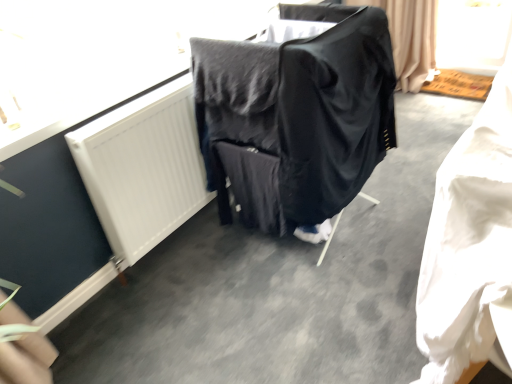
Question: Does white fabric at lower right have a greater width compared to white matte radiator at upper left?

Choices:
 (A) yes
 (B) no

Answer: (A)

Question: Can you confirm if white fabric at lower right is shorter than white matte radiator at upper left?

Choices:
 (A) yes
 (B) no

Answer: (B)

Question: Can you confirm if white fabric at lower right is positioned to the right of white matte radiator at upper left?

Choices:
 (A) no
 (B) yes

Answer: (B)

Question: Does white fabric at lower right have a lesser width compared to white matte radiator at upper left?

Choices:
 (A) no
 (B) yes

Answer: (A)

Question: From a real-world perspective, is white fabric at lower right beneath white matte radiator at upper left?

Choices:
 (A) yes
 (B) no

Answer: (B)

Question: Is black fabric-covered chair at center in front of or behind white matte radiator at upper left in the image?

Choices:
 (A) front
 (B) behind

Answer: (A)

Question: From the image's perspective, is black fabric-covered chair at center positioned above or below white matte radiator at upper left?

Choices:
 (A) above
 (B) below

Answer: (A)

Question: Visually, is black fabric-covered chair at center positioned to the left or to the right of white matte radiator at upper left?

Choices:
 (A) left
 (B) right

Answer: (B)

Question: Is black fabric-covered chair at center inside or outside of white matte radiator at upper left?

Choices:
 (A) inside
 (B) outside

Answer: (B)

Question: From the image's perspective, is white fabric at lower right located above or below white matte radiator at upper left?

Choices:
 (A) below
 (B) above

Answer: (A)

Question: In the image, is white fabric at lower right positioned in front of or behind white matte radiator at upper left?

Choices:
 (A) behind
 (B) front

Answer: (B)

Question: Is white fabric at lower right inside or outside of white matte radiator at upper left?

Choices:
 (A) inside
 (B) outside

Answer: (B)

Question: Considering the positions of point (487, 246) and point (119, 129), is point (487, 246) closer or farther from the camera than point (119, 129)?

Choices:
 (A) closer
 (B) farther

Answer: (A)

Question: From the image's perspective, is black fabric-covered chair at center positioned above or below white fabric at lower right?

Choices:
 (A) below
 (B) above

Answer: (B)

Question: Is black fabric-covered chair at center inside or outside of white fabric at lower right?

Choices:
 (A) outside
 (B) inside

Answer: (A)